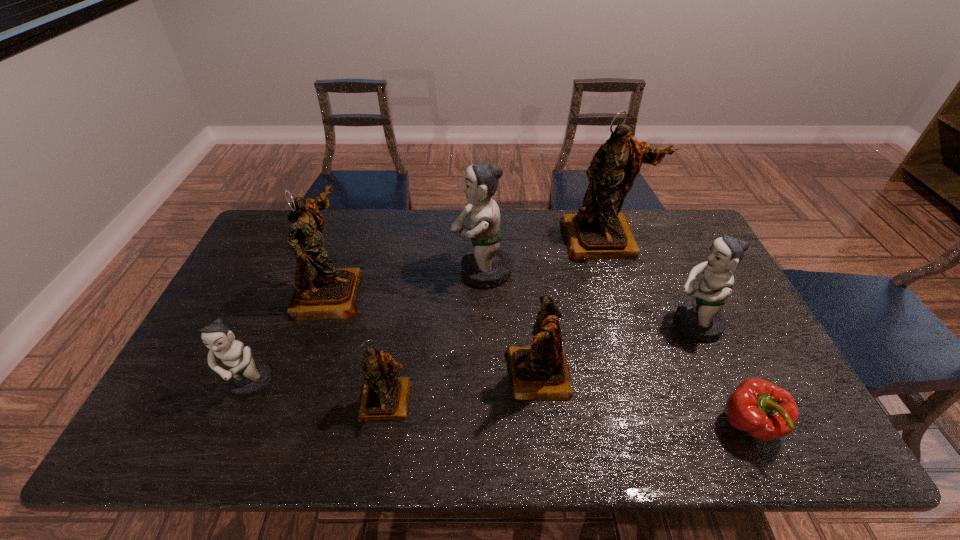
This screenshot has height=540, width=960. Find the location of `the third figurine from left to right`. the third figurine from left to right is located at coordinates (384, 397).

The image size is (960, 540). Identify the location of the leftmost green figurine. (246, 377).

Locate an element on the screen. The image size is (960, 540). the nearest green figurine is located at coordinates click(246, 377).

You are a GUI agent. You are given a task and a screenshot of the screen. Output one action in this format:
    pyautogui.click(x=<x>, y=<y>)
    Task: Click on the pink pepper
    This screenshot has height=540, width=960.
    Given the screenshot: What is the action you would take?
    pyautogui.click(x=767, y=412)

This screenshot has width=960, height=540. I want to click on pepper, so click(767, 412).

The width and height of the screenshot is (960, 540). In order to click on vacant space located 0.170m on the front-facing side of the tallest figurine in this screenshot , I will do `click(621, 302)`.

Identify the location of vacant region located 0.270m on the front-facing side of the farthest green figurine. (368, 271).

The image size is (960, 540). I want to click on vacant space located on the front-facing side of the farthest green figurine, so pyautogui.click(x=352, y=271).

This screenshot has width=960, height=540. What are the coordinates of `free location located on the front-facing side of the farthest green figurine` in the screenshot? It's located at (384, 271).

At what (x,y) coordinates should I click in order to perform the action: click on blank area located on the front-facing side of the third smallest gold figurine. Please return your answer as a coordinate pair (x, y). This screenshot has width=960, height=540. Looking at the image, I should click on (471, 292).